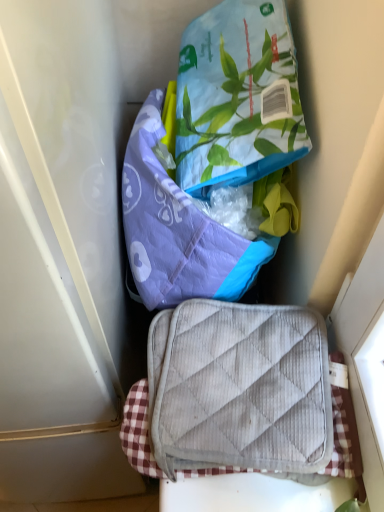
Locate an element on the screen. The image size is (384, 512). blank space situated above gray quilted suitcase at center (from a real-world perspective) is located at coordinates (275, 375).